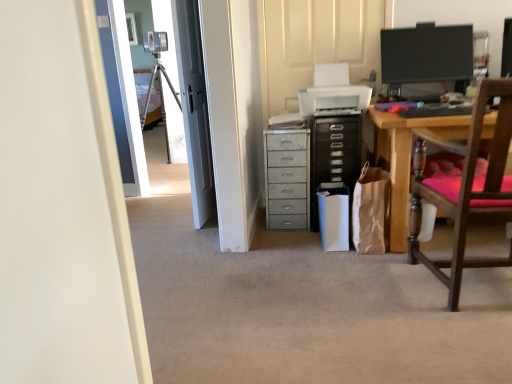
Question: In the image, is metallic gray chest of drawers at center positioned in front of or behind black glossy monitor at upper right?

Choices:
 (A) behind
 (B) front

Answer: (A)

Question: Is metallic gray chest of drawers at center situated inside black glossy monitor at upper right or outside?

Choices:
 (A) inside
 (B) outside

Answer: (B)

Question: Which object is positioned farthest from the metallic gray chest of drawers at center?

Choices:
 (A) brown paper bag at lower right
 (B) black glossy monitor at upper right
 (C) wooden chair with pink cushion at right

Answer: (B)

Question: Estimate the real-world distances between objects in this image. Which object is farther from the wooden chair with pink cushion at right?

Choices:
 (A) black glossy monitor at upper right
 (B) metallic gray chest of drawers at center
 (C) brown paper bag at lower right

Answer: (A)